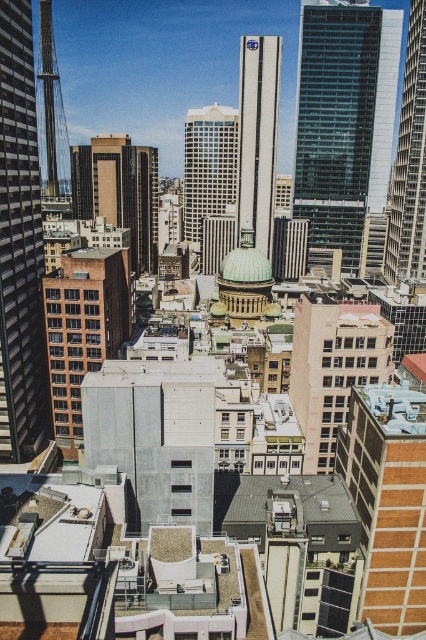
You are a delivery drone carrying a package that requires a minimum of 15 meters of clearance between buildings to safely navigate. You need to fly between the glassy steel skyscraper at left and the brown brick building at left. Can you safely pass through this gap?

The glassy steel skyscraper at left is 13.24 meters away from the brown brick building at left. Since the required clearance is 15 meters, the gap is insufficient for safe passage. The drone cannot safely pass through this gap.